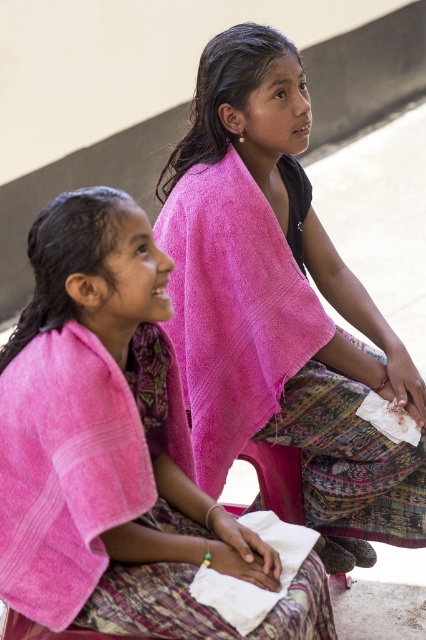
Does pink fabric at center appear on the left side of pink towel at upper center?

Incorrect, pink fabric at center is not on the left side of pink towel at upper center.

Does pink fabric at center appear over pink towel at upper center?

Yes.

Image resolution: width=426 pixels, height=640 pixels. What do you see at coordinates (279, 310) in the screenshot?
I see `pink fabric at center` at bounding box center [279, 310].

This screenshot has height=640, width=426. I want to click on pink fabric at center, so click(279, 310).

Who is lower down, pink towel at left or pink towel at upper center?

pink towel at left is below.

Between point (209, 516) and point (204, 304), which one is positioned in front?

Point (209, 516) is more forward.

What do you see at coordinates (106, 440) in the screenshot? I see `pink towel at left` at bounding box center [106, 440].

At what (x,y) coordinates should I click in order to perform the action: click on pink towel at left. Please return your answer as a coordinate pair (x, y). Looking at the image, I should click on (106, 440).

Does point (351, 346) lie in front of point (80, 211)?

No, it is behind (80, 211).

Does point (311, 496) come behind point (100, 500)?

That is True.

Between point (328, 384) and point (126, 486), which one is positioned behind?

The point (328, 384) is more distant.

Where is `pink fabric at center`? This screenshot has width=426, height=640. pink fabric at center is located at coordinates (279, 310).